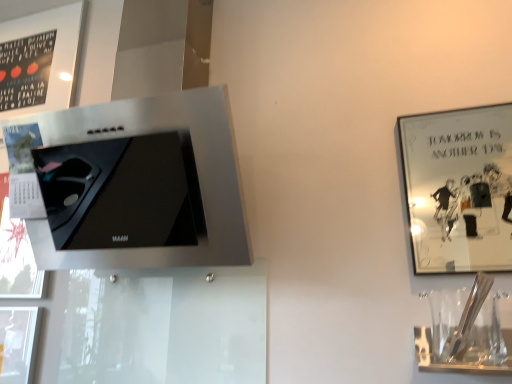
Question: From the image's perspective, is clear glass wine glass at lower right above or below metallic silver picture frame at upper right, marked as the 2th picture frame in a top-to-bottom arrangement?

Choices:
 (A) below
 (B) above

Answer: (A)

Question: Do you think clear glass wine glass at lower right is within metallic silver picture frame at upper right, the 2th picture frame positioned from the back, or outside of it?

Choices:
 (A) inside
 (B) outside

Answer: (B)

Question: Which of these objects is positioned closest to the satin silver range hood at upper left?

Choices:
 (A) clear glass wine glass at lower right
 (B) matte black frame at upper left, positioned as the second picture frame in bottom-to-top order
 (C) metallic silver picture frame at upper right, which is the second picture frame in left-to-right order

Answer: (B)

Question: Based on their relative distances, which object is farther from the matte black frame at upper left, which ranks as the first picture frame in top-to-bottom order?

Choices:
 (A) satin silver range hood at upper left
 (B) clear glass wine glass at lower right
 (C) metallic silver picture frame at upper right, marked as the 1th picture frame in a bottom-to-top arrangement

Answer: (C)